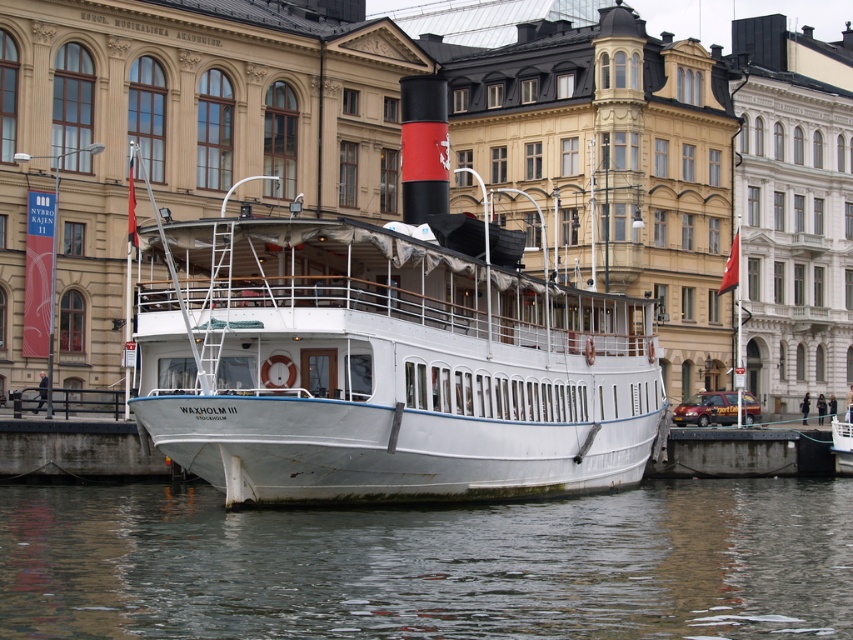
You are standing on the concrete at lower center and want to board the white matte boat at center. Which direction should you move to reach the boat?

Since the white matte boat at center is closer to the viewer than the concrete at lower center, you should move forward towards the boat.

You are standing on the dock and want to step onto the concrete at lower center. However, you notice the smooth gray water at lower center nearby. Which surface is wider? Please choose between the two.

The smooth gray water at lower center is wider than the concrete at lower center, so the water is the wider surface.

Based on the photo, you are standing on the concrete at lower center and want to step onto the smooth gray water at lower center. Is this possible?

The smooth gray water at lower center is located below the concrete at lower center, so stepping onto it from the concrete at lower center would require moving downward, which is not feasible since water cannot support your weight.